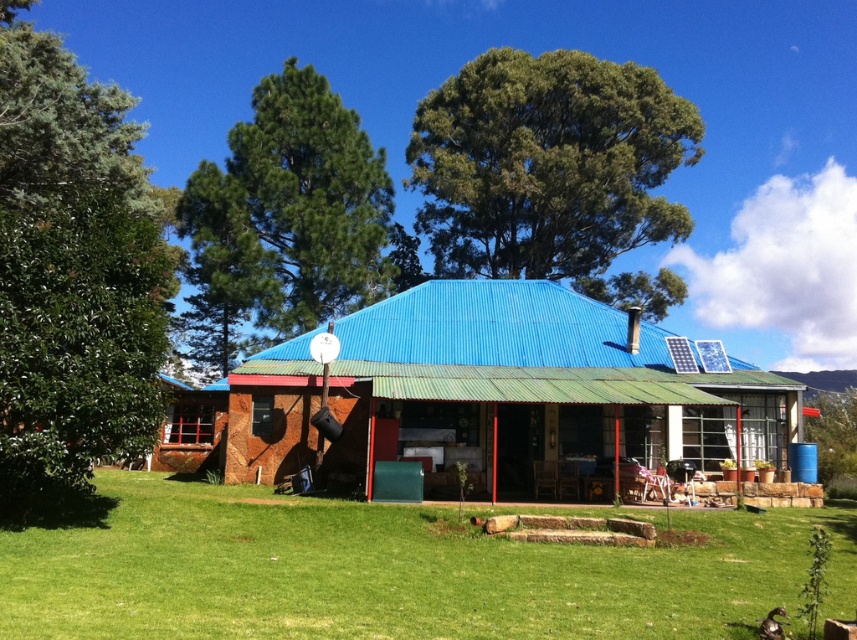
Which is more to the left, green leafy tree at left or green leafy tree at upper left?

green leafy tree at left is more to the left.

What do you see at coordinates (70, 275) in the screenshot? The width and height of the screenshot is (857, 640). I see `green leafy tree at left` at bounding box center [70, 275].

Find the location of a particular element. This screenshot has height=640, width=857. green leafy tree at left is located at coordinates (70, 275).

Image resolution: width=857 pixels, height=640 pixels. I want to click on green leafy tree at left, so click(70, 275).

Who is lower down, green grass at center or green leafy tree at upper center?

Positioned lower is green grass at center.

Does green grass at center have a greater height compared to green leafy tree at upper center?

No.

The height and width of the screenshot is (640, 857). In order to click on green grass at center in this screenshot , I will do `click(394, 572)`.

At what (x,y) coordinates should I click in order to perform the action: click on green grass at center. Please return your answer as a coordinate pair (x, y). The height and width of the screenshot is (640, 857). Looking at the image, I should click on (394, 572).

Is point (76, 614) positioned in front of point (334, 196)?

Yes, point (76, 614) is in front of point (334, 196).

Identify the location of green grass at center. (394, 572).